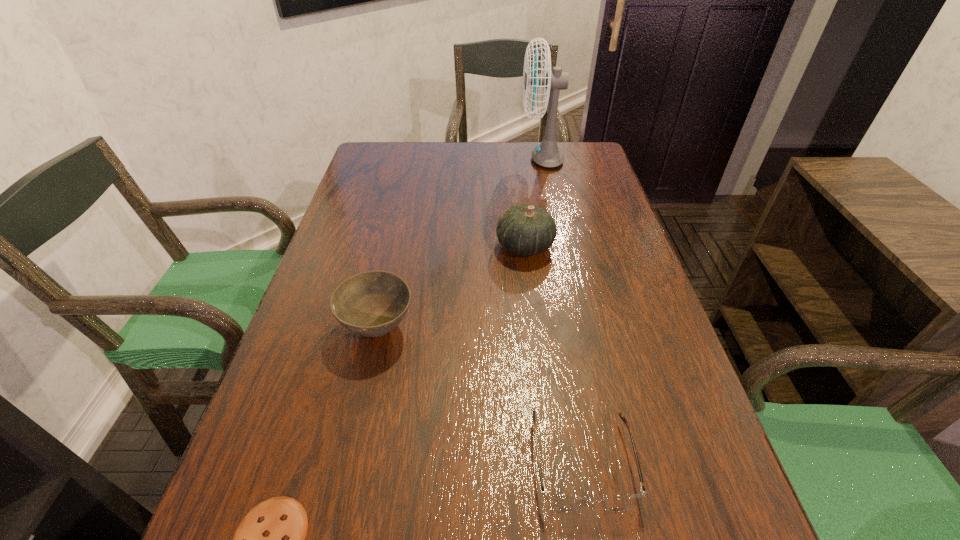
The height and width of the screenshot is (540, 960). I want to click on vacant space located 0.060m on the right of the second tallest object, so click(578, 246).

This screenshot has width=960, height=540. Identify the location of vacant space located on the back of the third tallest object. (x=404, y=208).

In order to click on object that is at the far edge in this screenshot , I will do `click(547, 154)`.

The image size is (960, 540). Find the location of `object positioned at the left edge`. object positioned at the left edge is located at coordinates (373, 303).

The width and height of the screenshot is (960, 540). What are the coordinates of `fan situated at the right edge` in the screenshot? It's located at (547, 154).

Identify the location of spectacles positioned at the right edge. Image resolution: width=960 pixels, height=540 pixels. coord(559,502).

Locate an element on the screen. object that is at the far right corner is located at coordinates (547, 154).

Locate an element on the screen. free space at the far edge of the desktop is located at coordinates (450, 173).

In the image, there is a desktop. Where is `vacant region at the left edge`? The height and width of the screenshot is (540, 960). vacant region at the left edge is located at coordinates click(x=286, y=344).

Locate an element on the screen. vacant area at the right edge of the desktop is located at coordinates (652, 345).